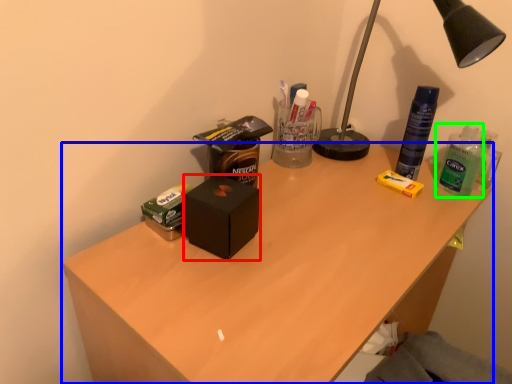
Question: Considering the real-world distances, which object is closest to box (highlighted by a red box)? desk (highlighted by a blue box) or bottle (highlighted by a green box).

Choices:
 (A) desk
 (B) bottle

Answer: (A)